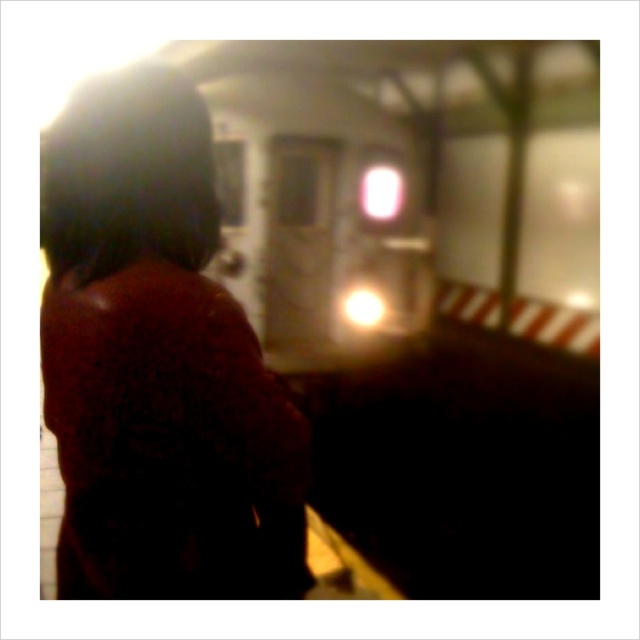
Can you confirm if dark brown fur coat at upper left is shorter than metallic silver train at center?

Correct, dark brown fur coat at upper left is not as tall as metallic silver train at center.

Where is `dark brown fur coat at upper left`? This screenshot has height=640, width=640. dark brown fur coat at upper left is located at coordinates (157, 364).

Identify the location of dark brown fur coat at upper left. The width and height of the screenshot is (640, 640). pyautogui.click(x=157, y=364).